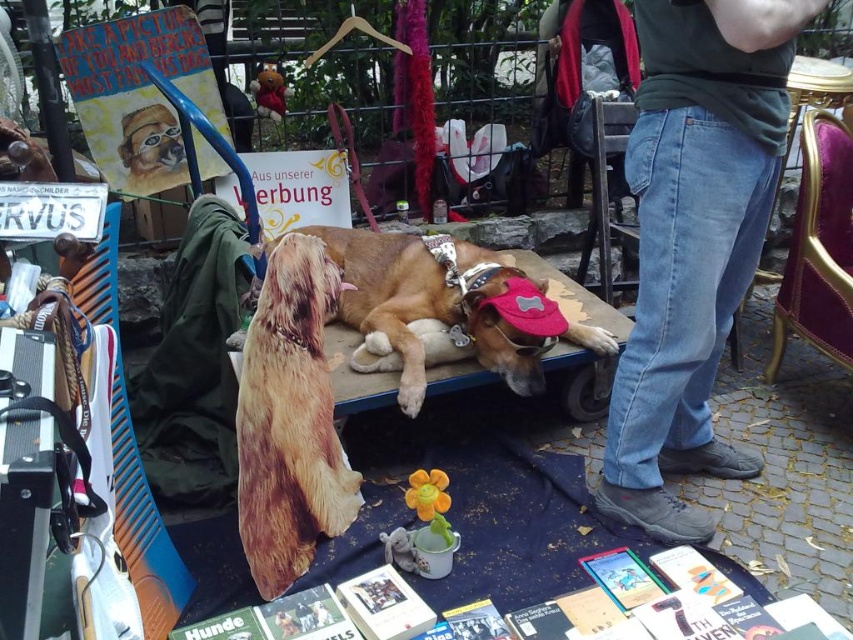
Looking at this image, you are standing at the center of the market and want to find the jeans at lower right. According to the coordinates provided, in which direction should you move to reach them?

The jeans at lower right is located at point (693, 240), which corresponds to the lower right area of the image. Since you are at the center, you should move towards the lower right direction to reach them.

You are at the flea market and see the jeans at lower right and the brown fur dog at center. Which item is positioned more to the right side of the scene?

The jeans at lower right are positioned to the right of the brown fur dog at center, so the jeans at lower right are more to the right side of the scene.

What are the coordinates of the jeans at lower right in the image?

The jeans at lower right are located at coordinates point (693, 240).